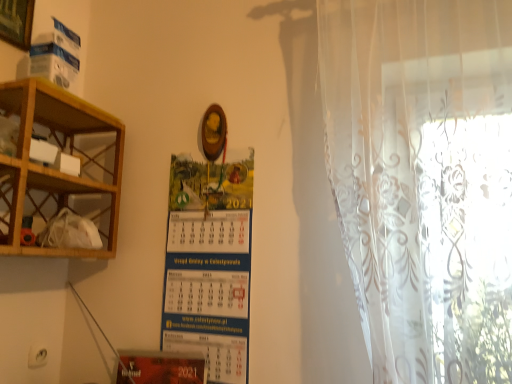
Question: Are wooden picture frame at upper left and transparent floral curtain at right far apart?

Choices:
 (A) no
 (B) yes

Answer: (B)

Question: Can transparent floral curtain at right be found inside wooden picture frame at upper left?

Choices:
 (A) no
 (B) yes

Answer: (A)

Question: Is wooden picture frame at upper left oriented away from transparent floral curtain at right?

Choices:
 (A) yes
 (B) no

Answer: (B)

Question: Can you confirm if wooden picture frame at upper left is wider than transparent floral curtain at right?

Choices:
 (A) yes
 (B) no

Answer: (B)

Question: From the image's perspective, is wooden picture frame at upper left on transparent floral curtain at right?

Choices:
 (A) yes
 (B) no

Answer: (A)

Question: Are wooden picture frame at upper left and transparent floral curtain at right making contact?

Choices:
 (A) yes
 (B) no

Answer: (B)

Question: Is wooden shelf at left in contact with transparent floral curtain at right?

Choices:
 (A) yes
 (B) no

Answer: (B)

Question: From a real-world perspective, is wooden shelf at left physically above transparent floral curtain at right?

Choices:
 (A) yes
 (B) no

Answer: (B)

Question: From the image's perspective, does wooden shelf at left appear higher than transparent floral curtain at right?

Choices:
 (A) no
 (B) yes

Answer: (A)

Question: Is wooden shelf at left not inside transparent floral curtain at right?

Choices:
 (A) yes
 (B) no

Answer: (A)

Question: Does wooden shelf at left have a greater height compared to transparent floral curtain at right?

Choices:
 (A) no
 (B) yes

Answer: (A)

Question: Can you confirm if wooden shelf at left is wider than transparent floral curtain at right?

Choices:
 (A) yes
 (B) no

Answer: (A)

Question: Considering the relative sizes of transparent floral curtain at right and blue paper calendar at center in the image provided, is transparent floral curtain at right taller than blue paper calendar at center?

Choices:
 (A) yes
 (B) no

Answer: (A)